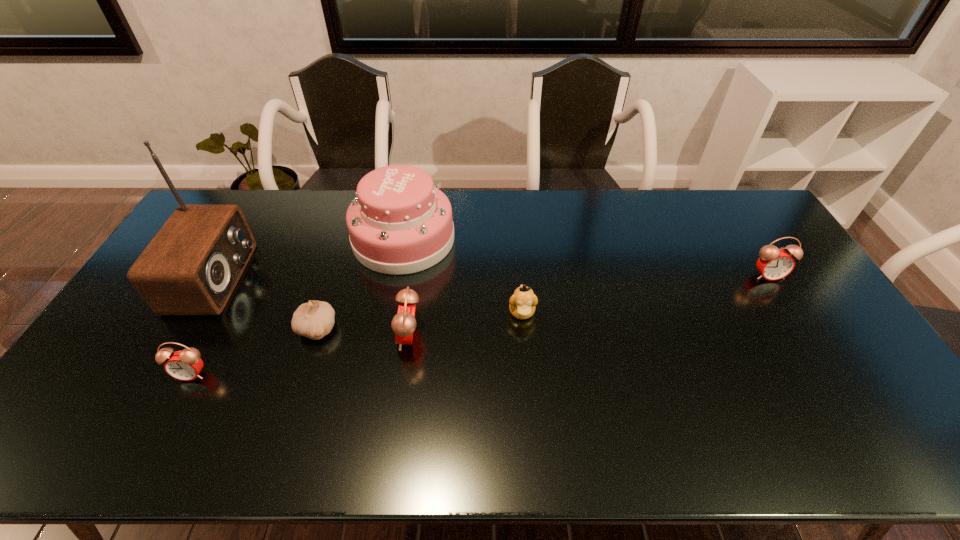
The height and width of the screenshot is (540, 960). What are the coordinates of `free space between the second alarm clock from right to left and the garlic` in the screenshot? It's located at (363, 333).

You are a GUI agent. You are given a task and a screenshot of the screen. Output one action in this format:
    pyautogui.click(x=<x>, y=<y>)
    Task: Click on the blank region between the radio receiver and the sixth object from left to right
    This screenshot has width=960, height=540.
    Given the screenshot: What is the action you would take?
    pyautogui.click(x=369, y=295)

Identify the location of free space between the second alarm clock from left to right and the sixth object from left to right. The width and height of the screenshot is (960, 540). (466, 325).

The image size is (960, 540). I want to click on unoccupied position between the nearest alarm clock and the second alarm clock from left to right, so click(300, 355).

You are a GUI agent. You are given a task and a screenshot of the screen. Output one action in this format:
    pyautogui.click(x=<x>, y=<y>)
    Task: Click on the empty space between the farthest alarm clock and the duckling
    The height and width of the screenshot is (540, 960).
    Given the screenshot: What is the action you would take?
    pyautogui.click(x=645, y=294)

You are a GUI agent. You are given a task and a screenshot of the screen. Output one action in this format:
    pyautogui.click(x=<x>, y=<y>)
    Task: Click on the empty location between the duckling and the shortest alarm clock
    The height and width of the screenshot is (540, 960).
    Given the screenshot: What is the action you would take?
    pyautogui.click(x=357, y=343)

This screenshot has height=540, width=960. What are the coordinates of `object that is the closest one to the duckling` in the screenshot? It's located at (400, 223).

Select which object appears as the sixth closest to the garlic. Please provide its 2D coordinates. Your answer should be formatted as a tuple, i.e. [(x, y)], where the tuple contains the x and y coordinates of a point satisfying the conditions above.

[(774, 264)]

Locate an element on the screen. The height and width of the screenshot is (540, 960). alarm clock that stands as the closest to the leftmost alarm clock is located at coordinates (403, 324).

Select which alarm clock appears as the third closest to the garlic. Please provide its 2D coordinates. Your answer should be formatted as a tuple, i.e. [(x, y)], where the tuple contains the x and y coordinates of a point satisfying the conditions above.

[(774, 264)]